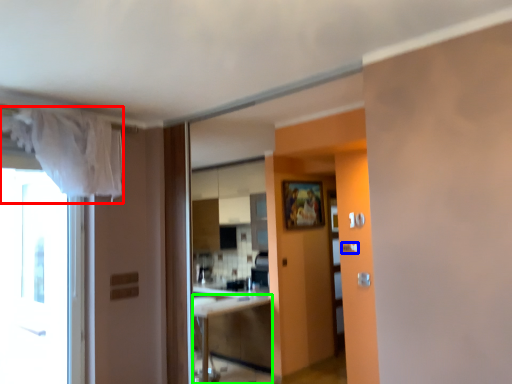
Question: Which is nearer to the curtain (highlighted by a red box)? door handle (highlighted by a blue box) or cabinetry (highlighted by a green box).

Choices:
 (A) door handle
 (B) cabinetry

Answer: (A)